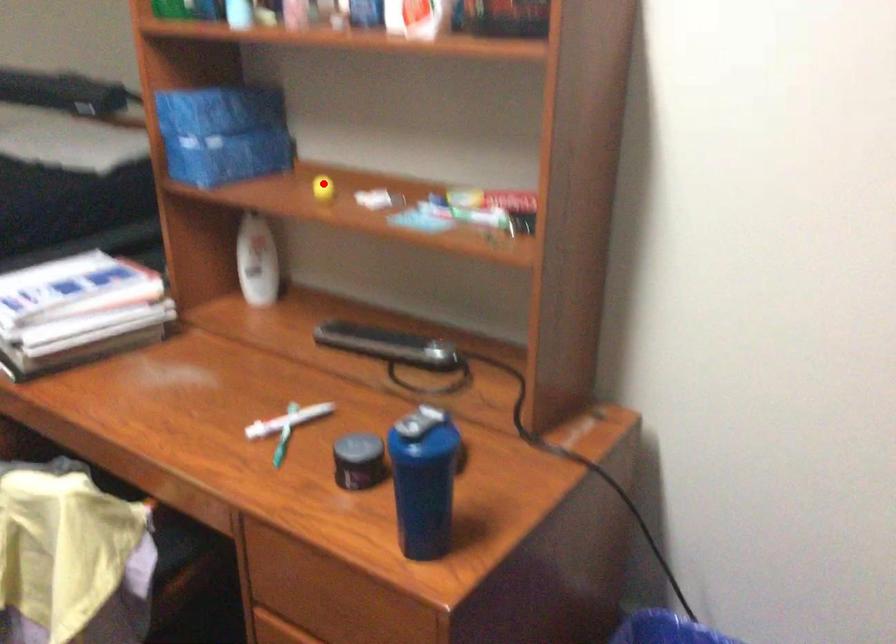
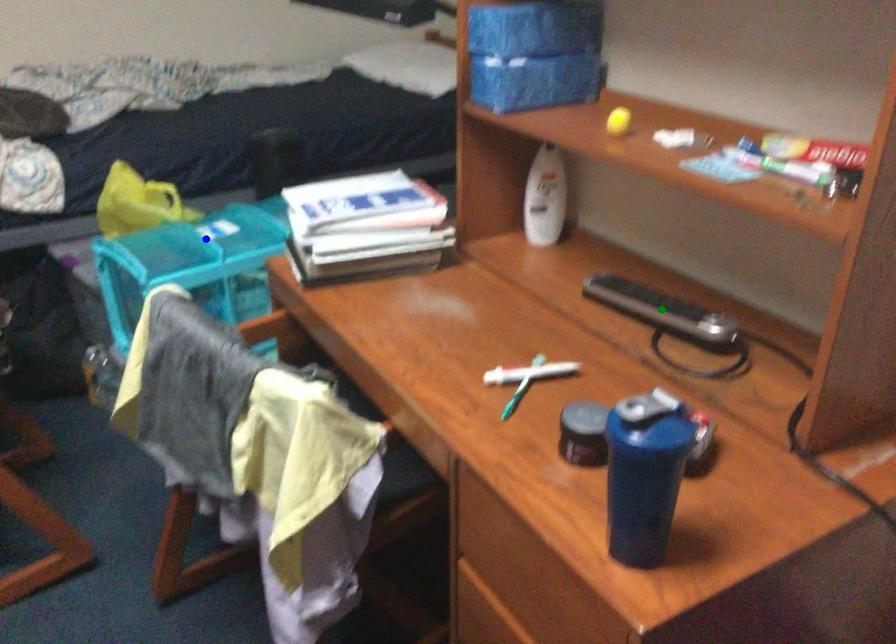
Question: I am providing you with two images of the same scene from different viewpoints. A red point is marked on the first image. You are given multiple points on the second image. Which point in image 2 is actually the same real-world point as the red point in image 1?

Choices:
 (A) yellow point
 (B) blue point
 (C) green point

Answer: (A)